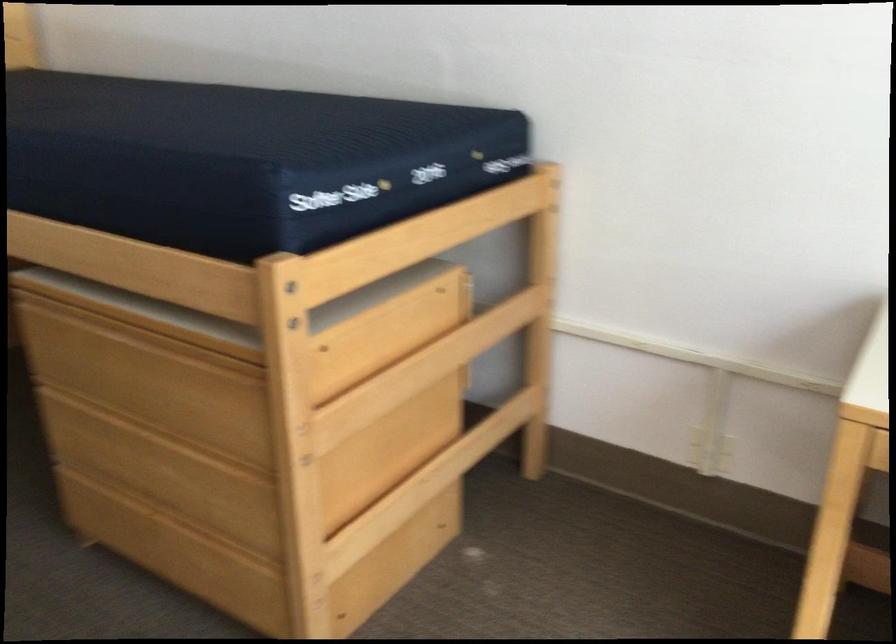
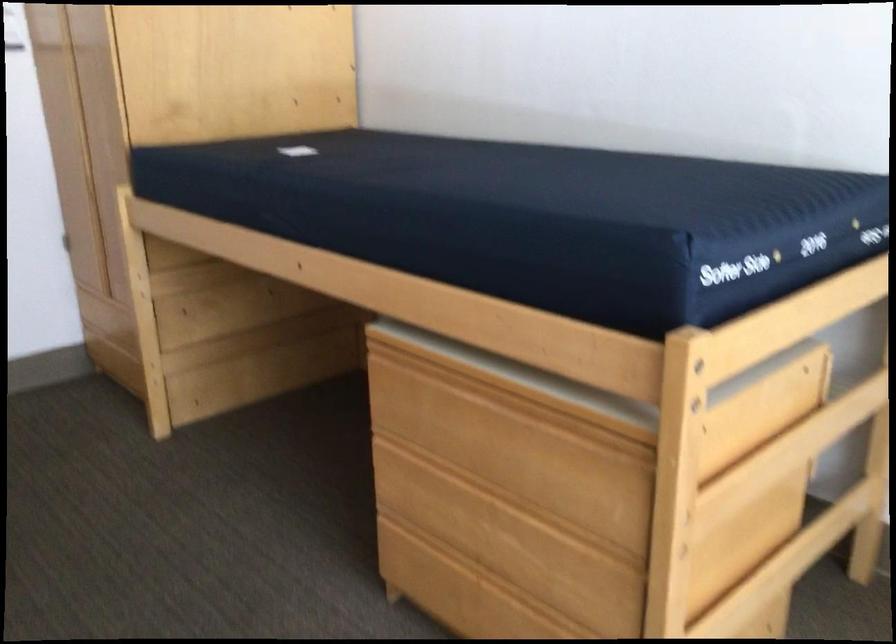
Question: The images are taken continuously from a first-person perspective. In which direction is your viewpoint rotating?

Choices:
 (A) Left
 (B) Right
 (C) Up
 (D) Down

Answer: (A)